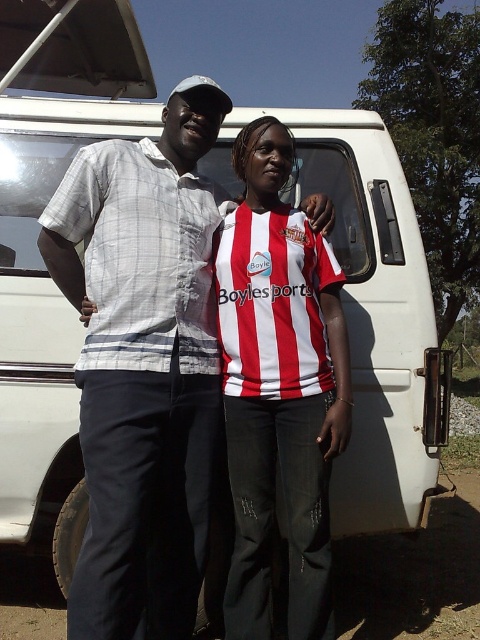
Question: Which of the following is the farthest from the observer?

Choices:
 (A) red and white striped shirt at center
 (B) white checkered shirt at center

Answer: (A)

Question: Which of the following is the closest to the observer?

Choices:
 (A) white checkered shirt at center
 (B) red and white striped shirt at center

Answer: (A)

Question: Does white checkered shirt at center lie in front of red and white striped shirt at center?

Choices:
 (A) yes
 (B) no

Answer: (A)

Question: Where is white checkered shirt at center located in relation to red and white striped shirt at center in the image?

Choices:
 (A) left
 (B) right

Answer: (A)

Question: Does white checkered shirt at center have a lesser width compared to red and white striped shirt at center?

Choices:
 (A) no
 (B) yes

Answer: (A)

Question: Which object is farther from the camera taking this photo?

Choices:
 (A) red and white striped shirt at center
 (B) white checkered shirt at center

Answer: (A)